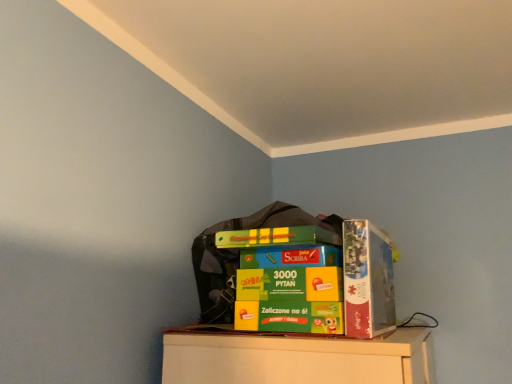
Question: Is matte cardboard box at upper right to the left or to the right of green cardboard box at upper center in the image?

Choices:
 (A) left
 (B) right

Answer: (B)

Question: Relative to green cardboard box at upper center, is matte cardboard box at upper right in front or behind?

Choices:
 (A) front
 (B) behind

Answer: (B)

Question: From the image's perspective, relative to green cardboard box at upper center, is matte cardboard box at upper right above or below?

Choices:
 (A) below
 (B) above

Answer: (B)

Question: Is point (301, 216) closer or farther from the camera than point (344, 258)?

Choices:
 (A) closer
 (B) farther

Answer: (B)

Question: In the image, is green cardboard box at upper center on the left side or the right side of matte cardboard box at upper right?

Choices:
 (A) right
 (B) left

Answer: (B)

Question: Considering their positions, is green cardboard box at upper center located in front of or behind matte cardboard box at upper right?

Choices:
 (A) behind
 (B) front

Answer: (B)

Question: From their relative heights in the image, would you say green cardboard box at upper center is taller or shorter than matte cardboard box at upper right?

Choices:
 (A) tall
 (B) short

Answer: (A)